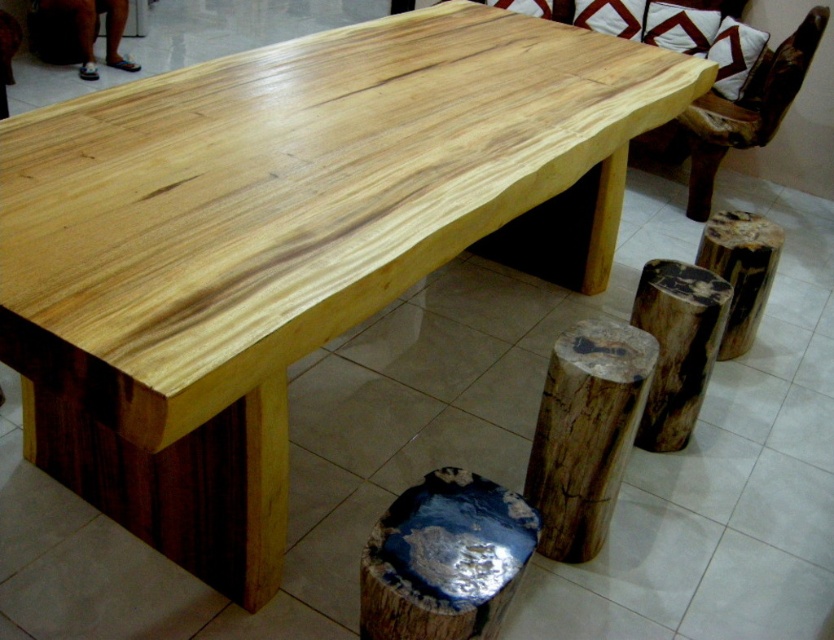
You are standing in front of the dining table and want to place a decorative item at point (611,486). The item requires a space that is at least 1.5 meters away from the viewer. Can you place it there?

The distance of point (611,486) from viewer is 1.80 meters, which is more than the required 1.5 meters. Therefore, you can place the decorative item there.

You are standing at the point labeled point (445, 557) in the dining area. What object are you currently standing on?

The point (445, 557) is on the blue polished wood stool at lower center.

You are standing at the camera position and want to pick up the natural wood log at lower center. Is the log within your immediate reach without moving your feet?

The natural wood log at lower center and camera are 5.31 feet apart from each other. Since 5.31 feet is approximately 64 inches, which is beyond typical human arm reach, you cannot pick up the log without moving your feet.